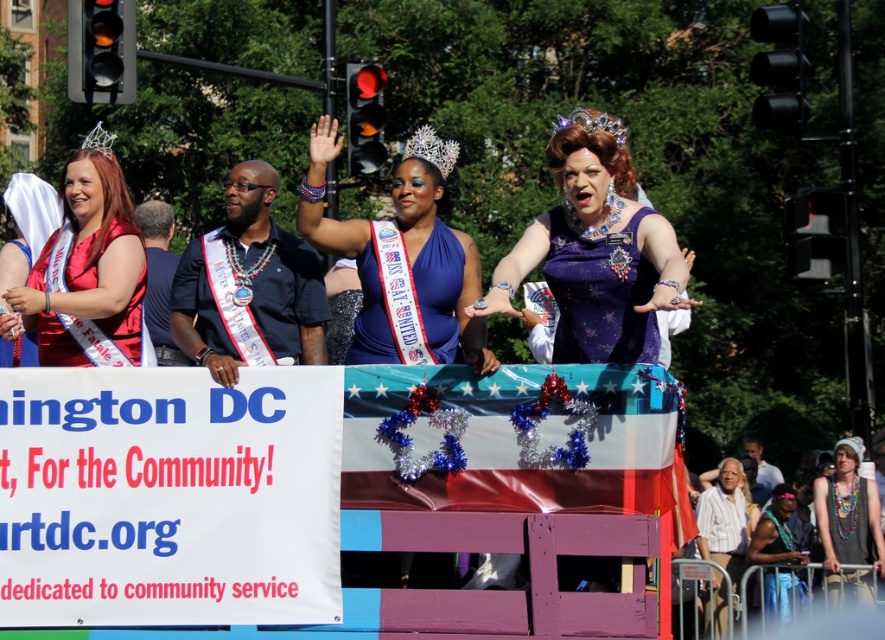
Question: Among these objects, which one is nearest to the camera?

Choices:
 (A) beige fabric tank top at lower right
 (B) matte red dress at left
 (C) sparkly purple dress at center

Answer: (C)

Question: Which point is closer to the camera?

Choices:
 (A) (306, 182)
 (B) (850, 508)
 (C) (672, 241)
 (D) (81, 305)

Answer: (C)

Question: Is shiny blue dress at center above beige fabric tank top at lower right?

Choices:
 (A) no
 (B) yes

Answer: (B)

Question: Is sparkly purple dress at center smaller than matte red dress at left?

Choices:
 (A) no
 (B) yes

Answer: (A)

Question: Which point appears farthest from the camera in this image?

Choices:
 (A) (836, 602)
 (B) (630, 360)
 (C) (358, 259)

Answer: (A)

Question: Does matte red dress at left have a lesser width compared to beige fabric tank top at lower right?

Choices:
 (A) yes
 (B) no

Answer: (B)